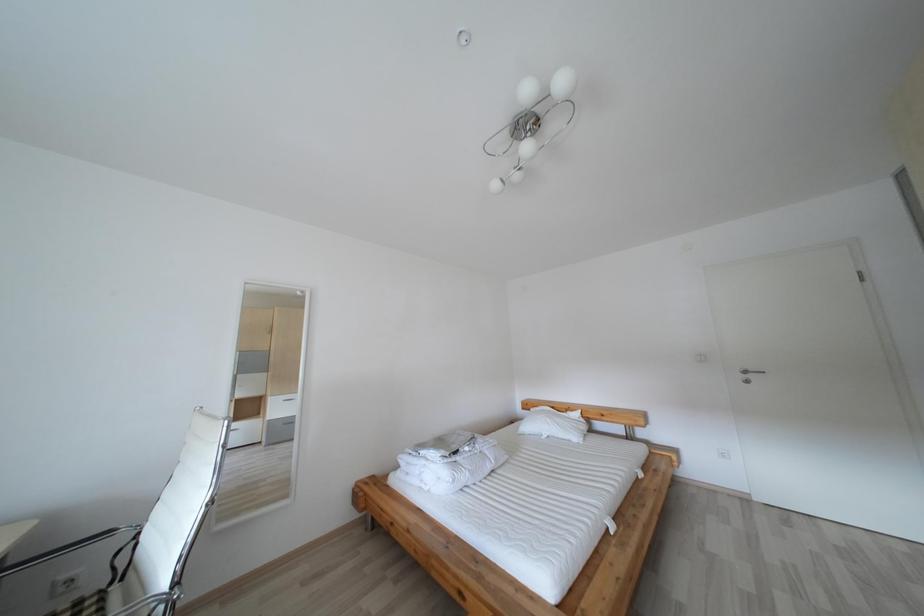
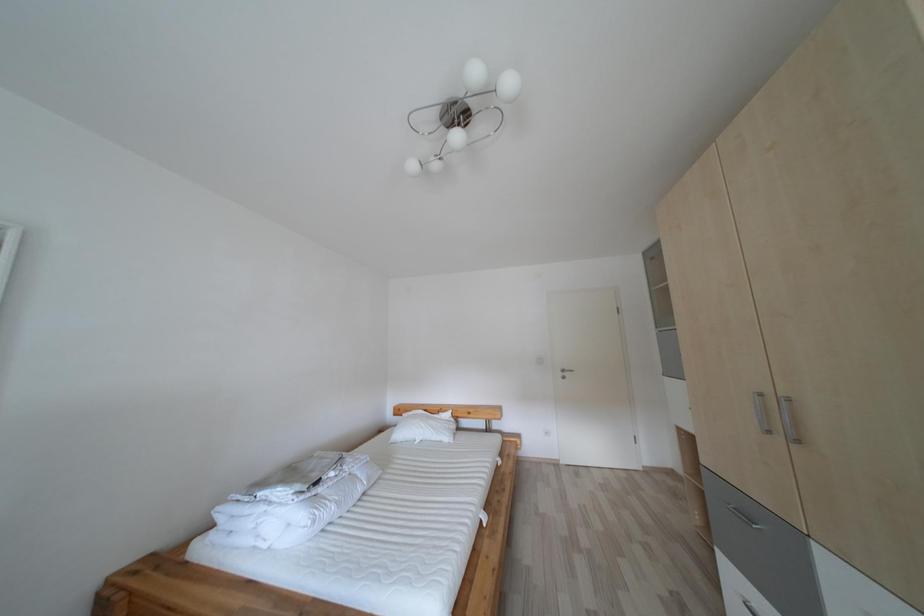
Question: Based on the continuous images, in which direction is the camera rotating? Reply with the corresponding letter.

Choices:
 (A) Left
 (B) Right
 (C) Up
 (D) Down

Answer: (B)